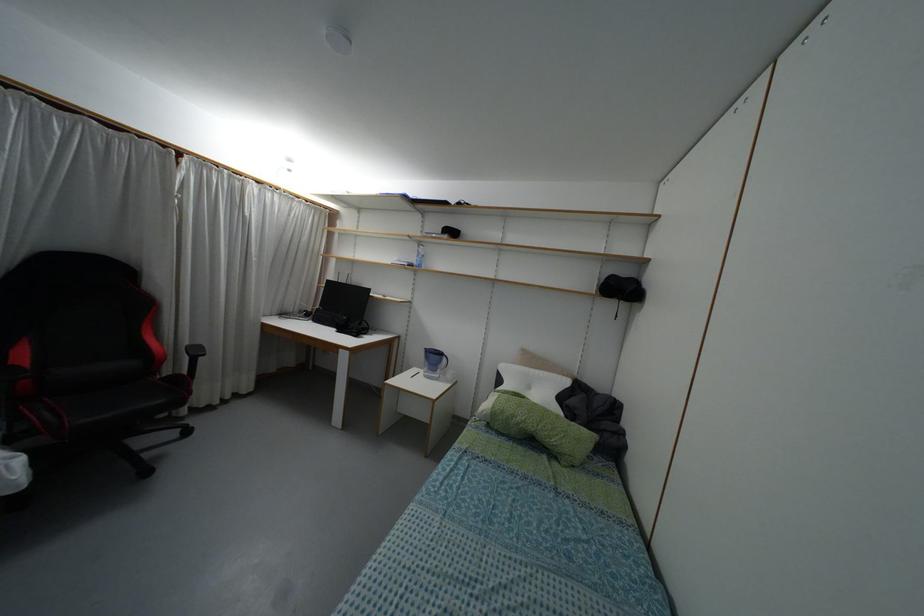
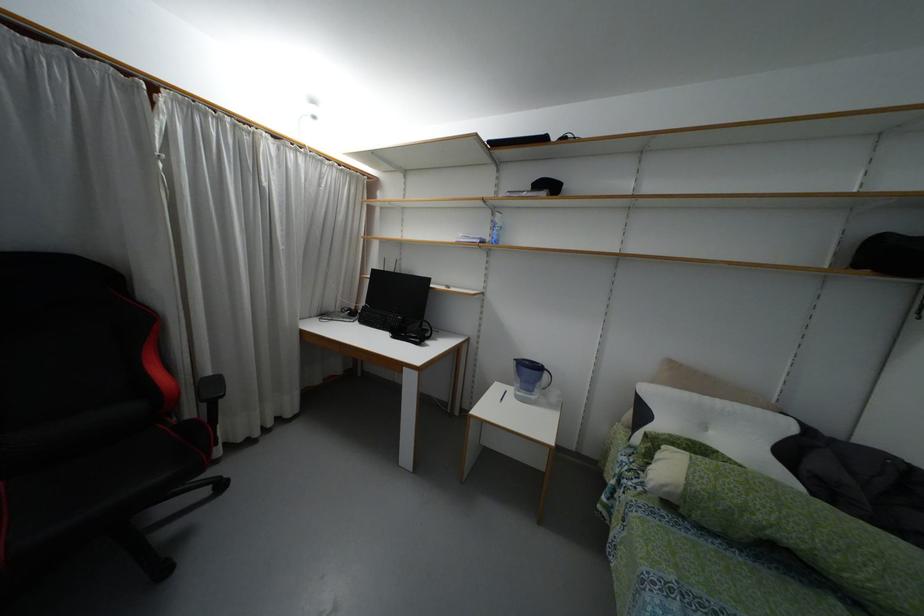
Locate, in the second image, the point that corresponds to (x=526, y=369) in the first image.

(695, 395)